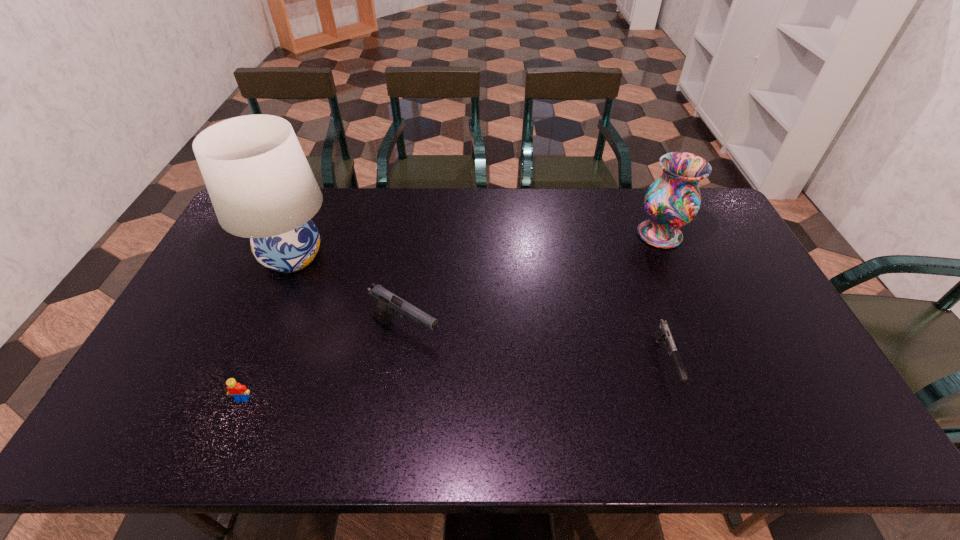
At what (x,y) coordinates should I click in order to perform the action: click on lampshade. Please return your answer as a coordinate pair (x, y). The width and height of the screenshot is (960, 540). Looking at the image, I should click on (259, 181).

Locate an element on the screen. This screenshot has width=960, height=540. the second tallest object is located at coordinates (673, 200).

This screenshot has width=960, height=540. I want to click on vase, so click(673, 200).

The width and height of the screenshot is (960, 540). Find the location of `the third shortest object`. the third shortest object is located at coordinates (386, 303).

Identify the location of the third object from right to left. (386, 303).

Image resolution: width=960 pixels, height=540 pixels. Identify the location of Lego. (239, 392).

Image resolution: width=960 pixels, height=540 pixels. I want to click on the fourth object from left to right, so click(664, 333).

Locate an element on the screen. the shorter gun is located at coordinates (664, 333).

I want to click on vacant area situated 0.230m on the front-facing side of the tallest object, so pyautogui.click(x=408, y=257).

Identify the location of vacant region located on the left of the rightmost object. The image size is (960, 540). (588, 234).